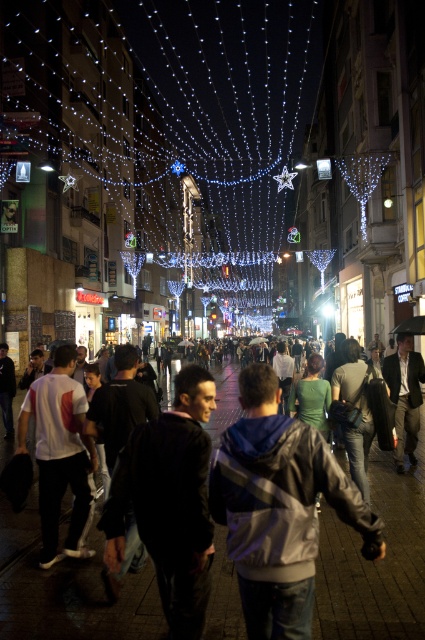
Question: Among these points, which one is farthest from the camera?

Choices:
 (A) (241, 93)
 (B) (141, 593)

Answer: (A)

Question: From the image, what is the correct spatial relationship of illuminated string lights at center in relation to dark clothing crowd at center?

Choices:
 (A) right
 (B) left

Answer: (B)

Question: Can you confirm if illuminated string lights at center is smaller than dark clothing crowd at center?

Choices:
 (A) yes
 (B) no

Answer: (B)

Question: Which of the following is the farthest from the observer?

Choices:
 (A) (367, 618)
 (B) (107, 81)

Answer: (B)

Question: Which point is farther from the camera taking this photo?

Choices:
 (A) (387, 493)
 (B) (180, 308)

Answer: (B)

Question: Is the position of illuminated string lights at center more distant than that of dark clothing crowd at center?

Choices:
 (A) yes
 (B) no

Answer: (A)